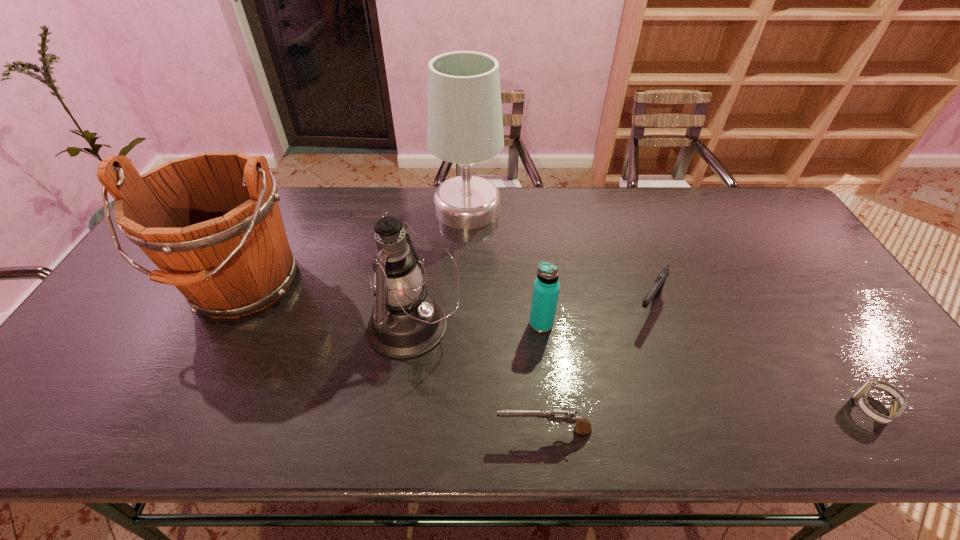
This screenshot has width=960, height=540. What are the coordinates of `free space between the shorter gun and the lampshade` in the screenshot? It's located at point(506,320).

Identify the location of free space between the lampshade and the leftmost object. The width and height of the screenshot is (960, 540). (355, 247).

Identify the location of vacant point located between the oil lamp and the left gun. 478,379.

Find the location of a particular element. The width and height of the screenshot is (960, 540). object that stands as the closest to the farthest object is located at coordinates (405, 322).

Locate which object ranks second in proximity to the oil lamp. Please provide its 2D coordinates. Your answer should be formatted as a tuple, i.e. [(x, y)], where the tuple contains the x and y coordinates of a point satisfying the conditions above.

[(583, 426)]

Identify the location of free location that satisfies the following two spatial constraints: 1. on the back side of the oil lamp; 2. on the left side of the fourth shortest object. This screenshot has width=960, height=540. (414, 324).

This screenshot has width=960, height=540. I want to click on free location that satisfies the following two spatial constraints: 1. on the front side of the fourth shortest object; 2. aiming along the barrel of the shorter gun, so click(554, 430).

Where is `vacant region that satisfies the following two spatial constraints: 1. on the base of the farthest object; 2. on the front side of the oil lamp`? The height and width of the screenshot is (540, 960). vacant region that satisfies the following two spatial constraints: 1. on the base of the farthest object; 2. on the front side of the oil lamp is located at coordinates (464, 327).

At what (x,y) coordinates should I click in order to perform the action: click on vacant position in the image that satisfies the following two spatial constraints: 1. on the base of the lampshade; 2. on the back side of the water bottle. Please return your answer as a coordinate pair (x, y). Looking at the image, I should click on (464, 324).